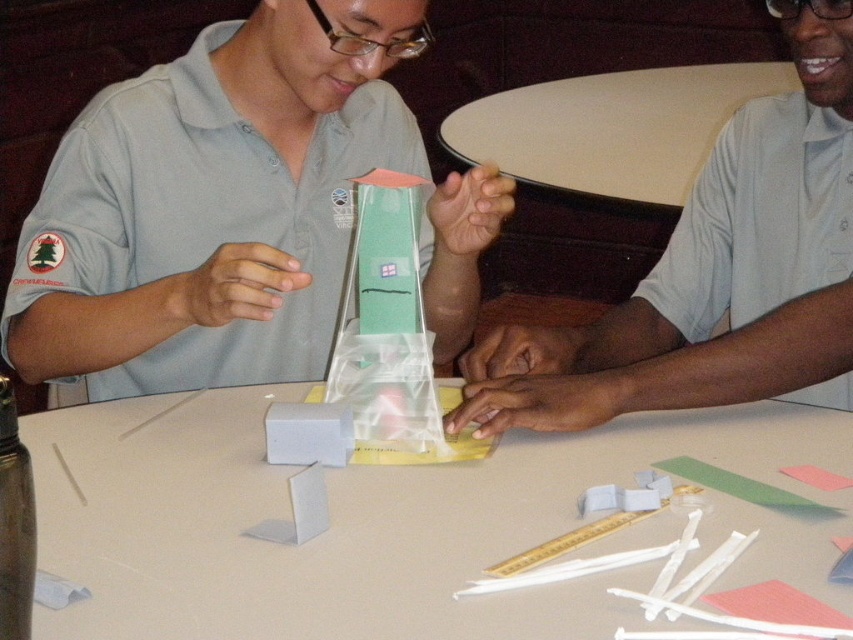
Question: Is the position of matte plastic tower at center less distant than that of gold metallic ruler at center?

Choices:
 (A) yes
 (B) no

Answer: (B)

Question: Estimate the real-world distances between objects in this image. Which object is closer to the matte gray shirt at upper right?

Choices:
 (A) gold metallic ruler at center
 (B) matte plastic tower at center
 (C) white paper at center

Answer: (C)

Question: Which is nearer to the transparent plastic tower at center?

Choices:
 (A) gold metallic ruler at center
 (B) white glossy table at upper center
 (C) matte gray shirt at upper right

Answer: (C)

Question: From the image, what is the correct spatial relationship of white paper at center in relation to gold metallic ruler at center?

Choices:
 (A) above
 (B) below

Answer: (A)

Question: Which point is farther from the camera taking this photo?

Choices:
 (A) (56, 208)
 (B) (404, 320)
 (C) (792, 248)

Answer: (C)

Question: Observing the image, what is the correct spatial positioning of white paper at center in reference to white glossy table at upper center?

Choices:
 (A) right
 (B) left

Answer: (B)